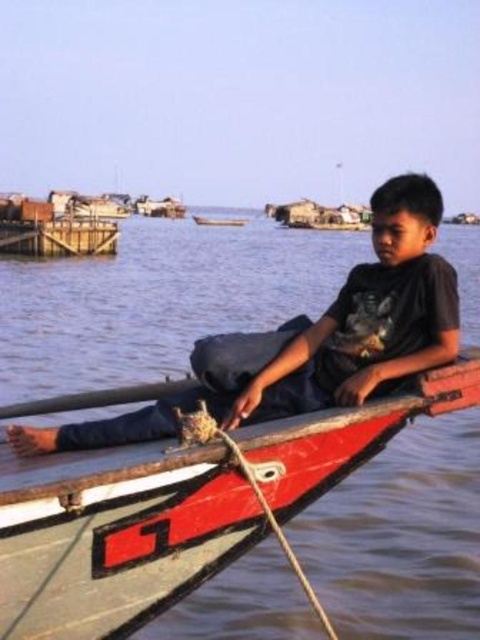
Question: Which point appears farthest from the camera in this image?

Choices:
 (A) (232, 218)
 (B) (354, 324)

Answer: (A)

Question: Does wooden canoe at center come in front of matte black shirt at center?

Choices:
 (A) no
 (B) yes

Answer: (A)

Question: Which point is closer to the camera taking this photo?

Choices:
 (A) (262, 358)
 (B) (444, 401)
 (C) (231, 224)

Answer: (B)

Question: Can you confirm if matte black shirt at center is thinner than smooth wood boat at center?

Choices:
 (A) yes
 (B) no

Answer: (A)

Question: Which is nearer to the wooden canoe at center?

Choices:
 (A) smooth wood boat at center
 (B) matte black shirt at center

Answer: (B)

Question: Is matte black shirt at center thinner than smooth wood boat at center?

Choices:
 (A) no
 (B) yes

Answer: (B)